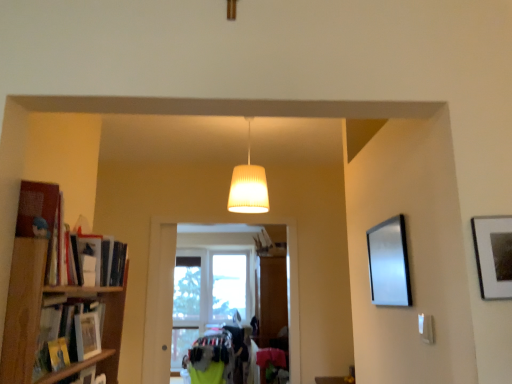
This screenshot has width=512, height=384. What do you see at coordinates (48, 229) in the screenshot?
I see `matte black bookshelf at left, positioned as the first book in top-to-bottom order` at bounding box center [48, 229].

This screenshot has height=384, width=512. What are the coordinates of `silver metallic picture frame at right` in the screenshot? It's located at (x=389, y=263).

The width and height of the screenshot is (512, 384). What do you see at coordinates (389, 263) in the screenshot? I see `silver metallic picture frame at right` at bounding box center [389, 263].

I want to click on transparent glass window at center, so click(x=208, y=293).

What do you see at coordinates (248, 186) in the screenshot?
I see `white ribbed lampshade at center` at bounding box center [248, 186].

This screenshot has width=512, height=384. In order to click on wooden photo frame at left, the 3th book positioned from the top in this screenshot , I will do `click(87, 335)`.

Find the location of a particular element. hardcover book at left, which is the 2th book in bottom-to-top order is located at coordinates (102, 258).

Measure the distance between hardcover book at left, positioned as the first book in back-to-front order, and camera.

1.53 meters.

The width and height of the screenshot is (512, 384). I want to click on matte black bookshelf at left, which appears as the first book when viewed from the front, so [48, 229].

From a real-world perspective, relative to wooden bookshelf at left, is white ribbed lampshade at center vertically above or below?

In terms of real-world spatial position, white ribbed lampshade at center is above wooden bookshelf at left.

Is white ribbed lampshade at center smaller than wooden bookshelf at left?

Yes.

Is white ribbed lampshade at center positioned with its back to wooden bookshelf at left?

That's not correct — white ribbed lampshade at center is not looking away from wooden bookshelf at left.

Considering the relative positions of white ribbed lampshade at center and wooden bookshelf at left in the image provided, is white ribbed lampshade at center to the left or to the right of wooden bookshelf at left?

In the image, white ribbed lampshade at center appears on the right side of wooden bookshelf at left.

From a real-world perspective, is transparent glass window at center below wooden bookshelf at left?

Correct, in the physical world, transparent glass window at center is lower than wooden bookshelf at left.

Find the location of a particular element. The height and width of the screenshot is (384, 512). shelf that appears above the transparent glass window at center (from a real-world perspective) is located at coordinates (57, 301).

Which of these two, transparent glass window at center or wooden bookshelf at left, is bigger?

transparent glass window at center is bigger.

From the image's perspective, is silver metallic picture frame at right below matte black bookshelf at left, which appears as the first book when viewed from the front?

Yes, from the image's perspective, silver metallic picture frame at right is beneath matte black bookshelf at left, which appears as the first book when viewed from the front.

Is the position of silver metallic picture frame at right more distant than that of matte black bookshelf at left, the third book when ordered from bottom to top?

Yes, silver metallic picture frame at right is further from the viewer.

Who is smaller, silver metallic picture frame at right or matte black bookshelf at left, the third book when ordered from bottom to top?

Smaller between the two is silver metallic picture frame at right.

Is silver metallic picture frame at right oriented towards matte black bookshelf at left, positioned as the first book in top-to-bottom order?

Yes, silver metallic picture frame at right is facing matte black bookshelf at left, positioned as the first book in top-to-bottom order.

Is wooden photo frame at left, placed as the 2th book when sorted from front to back, facing towards silver metallic picture frame at right?

Yes, wooden photo frame at left, placed as the 2th book when sorted from front to back, faces towards silver metallic picture frame at right.

From the image's perspective, between wooden photo frame at left, arranged as the second book when viewed from the back, and silver metallic picture frame at right, who is located below?

wooden photo frame at left, arranged as the second book when viewed from the back, from the image's perspective.

Considering the sizes of wooden photo frame at left, which is the 1th book from bottom to top, and silver metallic picture frame at right in the image, is wooden photo frame at left, which is the 1th book from bottom to top, taller or shorter than silver metallic picture frame at right?

wooden photo frame at left, which is the 1th book from bottom to top, is shorter than silver metallic picture frame at right.

Is point (404, 302) positioned behind point (181, 334)?

That is False.

Is transparent glass window at center a part of silver metallic picture frame at right?

Definitely not — transparent glass window at center is not inside silver metallic picture frame at right.

Can you confirm if silver metallic picture frame at right is shorter than transparent glass window at center?

Indeed, silver metallic picture frame at right has a lesser height compared to transparent glass window at center.

Based on the photo, considering the sizes of objects white ribbed lampshade at center and matte black bookshelf at left, marked as the 3th book in a back-to-front arrangement, in the image provided, who is thinner, white ribbed lampshade at center or matte black bookshelf at left, marked as the 3th book in a back-to-front arrangement,?

Thinner between the two is matte black bookshelf at left, marked as the 3th book in a back-to-front arrangement.

Locate an element on the screen. The width and height of the screenshot is (512, 384). lamp above the matte black bookshelf at left, which appears as the first book when viewed from the front (from the image's perspective) is located at coordinates (248, 186).

Between white ribbed lampshade at center and matte black bookshelf at left, the third book when ordered from bottom to top, which one has more height?

white ribbed lampshade at center.

Looking at the image, does white ribbed lampshade at center seem bigger or smaller compared to wooden photo frame at left, the 3th book positioned from the top?

white ribbed lampshade at center is bigger than wooden photo frame at left, the 3th book positioned from the top.

Who is shorter, white ribbed lampshade at center or wooden photo frame at left, placed as the 2th book when sorted from front to back?

wooden photo frame at left, placed as the 2th book when sorted from front to back, is shorter.

Is white ribbed lampshade at center oriented away from wooden photo frame at left, placed as the 2th book when sorted from front to back?

No, white ribbed lampshade at center is not facing away from wooden photo frame at left, placed as the 2th book when sorted from front to back.

Could you measure the distance between white ribbed lampshade at center and wooden photo frame at left, the 3th book positioned from the top?

A distance of 3.31 feet exists between white ribbed lampshade at center and wooden photo frame at left, the 3th book positioned from the top.

The height and width of the screenshot is (384, 512). Identify the location of shelf that is on the left side of white ribbed lampshade at center. (57, 301).

Locate an element on the screen. The width and height of the screenshot is (512, 384). shelf lying on the right of transparent glass window at center is located at coordinates (57, 301).

Estimate the real-world distances between objects in this image. Which object is further from white ribbed lampshade at center, silver metallic picture frame at right or matte black bookshelf at left, which appears as the first book when viewed from the front?

matte black bookshelf at left, which appears as the first book when viewed from the front, is further to white ribbed lampshade at center.

When comparing their distances from silver metallic picture frame at right, does matte black bookshelf at left, which appears as the first book when viewed from the front, or wooden bookshelf at left seem closer?

The object closer to silver metallic picture frame at right is matte black bookshelf at left, which appears as the first book when viewed from the front.

Which object lies further to the anchor point wooden photo frame at left, which is the 1th book from bottom to top, transparent glass window at center or white ribbed lampshade at center?

The object further to wooden photo frame at left, which is the 1th book from bottom to top, is transparent glass window at center.

Based on the photo, based on their spatial positions, is white ribbed lampshade at center or matte black bookshelf at left, positioned as the first book in top-to-bottom order, further from wooden photo frame at left, the 3th book positioned from the top?

Based on the image, white ribbed lampshade at center appears to be further to wooden photo frame at left, the 3th book positioned from the top.

Looking at the image, which one is located closer to silver metallic picture frame at right, hardcover book at left, positioned as the first book in back-to-front order, or matte black bookshelf at left, the third book when ordered from bottom to top?

Among the two, matte black bookshelf at left, the third book when ordered from bottom to top, is located nearer to silver metallic picture frame at right.

Based on their spatial positions, is matte black bookshelf at left, which appears as the first book when viewed from the front, or silver metallic picture frame at right further from wooden bookshelf at left?

silver metallic picture frame at right is positioned further to the anchor wooden bookshelf at left.

Estimate the real-world distances between objects in this image. Which object is closer to silver metallic picture frame at right, white ribbed lampshade at center or transparent glass window at center?

white ribbed lampshade at center is closer to silver metallic picture frame at right.

Looking at the image, which one is located further to white ribbed lampshade at center, transparent glass window at center or matte black bookshelf at left, the third book when ordered from bottom to top?

transparent glass window at center lies further to white ribbed lampshade at center than the other object.

This screenshot has height=384, width=512. I want to click on picture frame between wooden bookshelf at left and transparent glass window at center from front to back, so click(x=389, y=263).

I want to click on lamp between wooden photo frame at left, placed as the 2th book when sorted from front to back, and silver metallic picture frame at right from left to right, so click(248, 186).

Find the location of a particular element. The height and width of the screenshot is (384, 512). book located between matte black bookshelf at left, the third book when ordered from bottom to top, and hardcover book at left, acting as the 3th book starting from the front, in the depth direction is located at coordinates (87, 335).

Find the location of a particular element. The width and height of the screenshot is (512, 384). lamp located between silver metallic picture frame at right and transparent glass window at center in the depth direction is located at coordinates (248, 186).